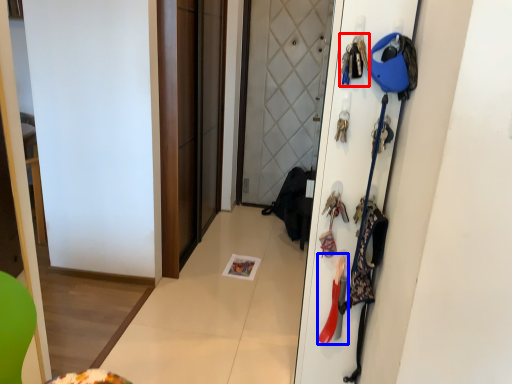
Question: Which of the following is the closest to the observer, accessory (highlighted by a red box) or accessory (highlighted by a blue box)?

Choices:
 (A) accessory
 (B) accessory

Answer: (A)